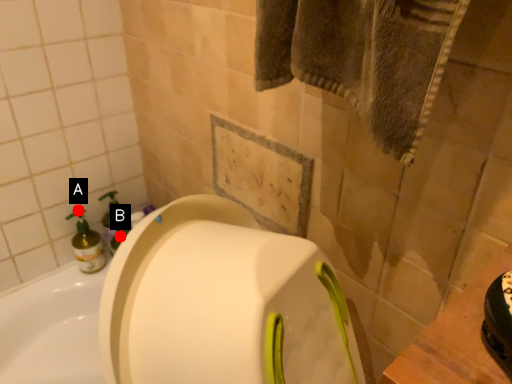
Question: Two points are circled on the image, labeled by A and B beside each circle. Among these points, which one is nearest to the camera?

Choices:
 (A) A is closer
 (B) B is closer

Answer: (A)